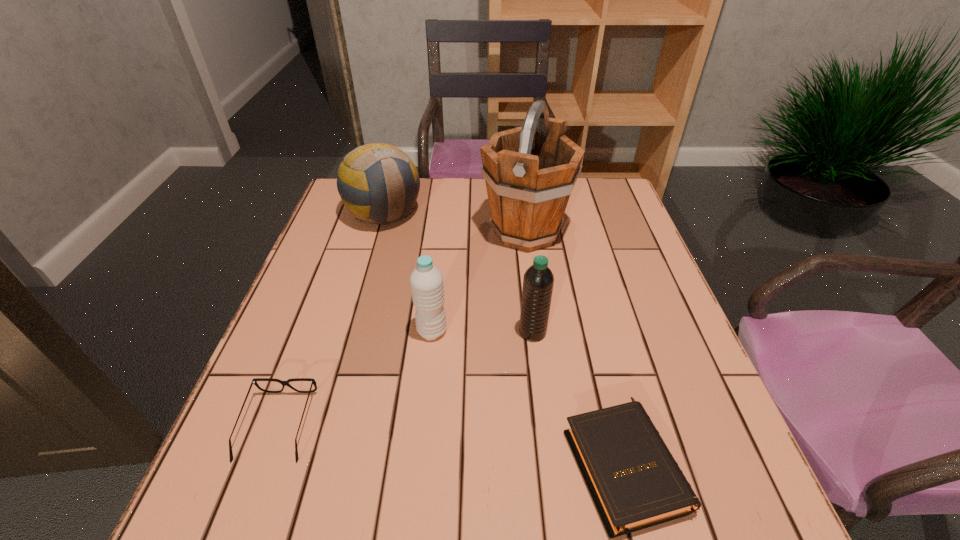
You are a GUI agent. You are given a task and a screenshot of the screen. Output one action in this format:
    pyautogui.click(x=<x>, y=<y>)
    Task: Click on the bucket
    The height and width of the screenshot is (540, 960).
    Given the screenshot: What is the action you would take?
    pyautogui.click(x=530, y=171)

Locate an element on the screen. volleyball is located at coordinates coord(378,183).

Where is `the right water bottle`? This screenshot has width=960, height=540. the right water bottle is located at coordinates pos(538,280).

This screenshot has width=960, height=540. I want to click on the left water bottle, so click(x=426, y=281).

At what (x,y) coordinates should I click in order to perform the action: click on spectacles. Please return your answer as a coordinate pair (x, y). The image size is (960, 540). Looking at the image, I should click on (254, 381).

You are a GUI agent. You are given a task and a screenshot of the screen. Output one action in this format:
    pyautogui.click(x=<x>, y=<y>)
    Task: Click on the Bible
    The image size is (960, 540).
    Given the screenshot: What is the action you would take?
    [x=635, y=483]

Find the location of a particular element. This screenshot has height=540, width=960. free location located on the right of the tallest object is located at coordinates (589, 232).

Locate an element on the screen. Image resolution: width=960 pixels, height=540 pixels. vacant space located 0.270m on the front of the volleyball is located at coordinates (358, 306).

This screenshot has width=960, height=540. I want to click on vacant region located 0.260m on the back of the right water bottle, so click(x=523, y=250).

The width and height of the screenshot is (960, 540). Find the location of `vacant region located on the front of the left water bottle`. vacant region located on the front of the left water bottle is located at coordinates (428, 366).